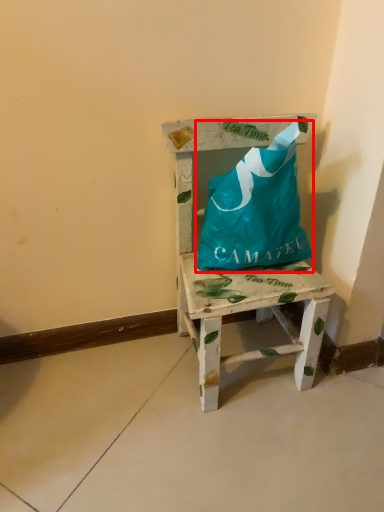
Question: From the image's perspective, what is the correct spatial relationship of wrap (annotated by the red box) in relation to furniture?

Choices:
 (A) above
 (B) below

Answer: (A)